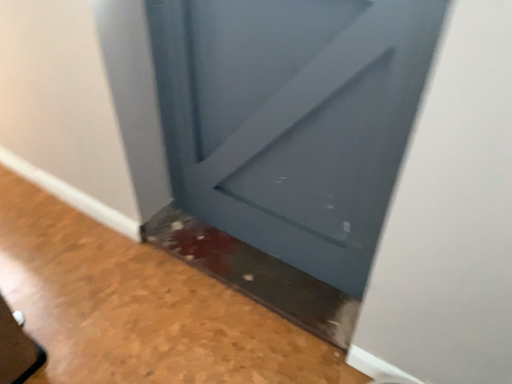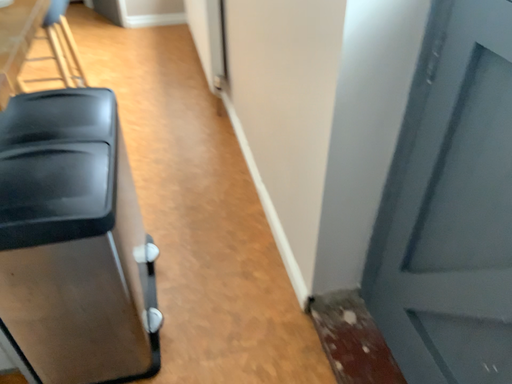
Question: How did the camera likely rotate when shooting the video?

Choices:
 (A) rotated right
 (B) rotated left

Answer: (B)